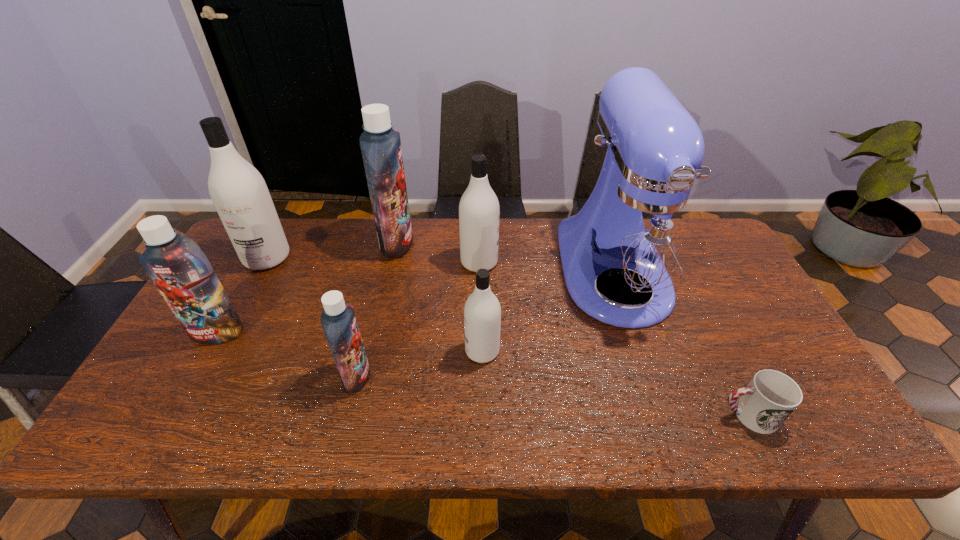
The image size is (960, 540). In order to click on the tallest object in this screenshot , I will do `click(640, 233)`.

The height and width of the screenshot is (540, 960). I want to click on mixer, so click(640, 233).

You are a GUI agent. You are given a task and a screenshot of the screen. Output one action in this format:
    pyautogui.click(x=<x>, y=<y>)
    Task: Click on the farthest blue shampoo
    
    Given the screenshot: What is the action you would take?
    pyautogui.click(x=380, y=145)

At what (x,y) coordinates should I click in order to perform the action: click on the biggest white shampoo. Please return your answer as a coordinate pair (x, y). Looking at the image, I should click on (239, 193).

Identify the location of the second biggest white shampoo. (479, 211).

Identify the location of the second biggest blue shampoo. The width and height of the screenshot is (960, 540). (176, 265).

The width and height of the screenshot is (960, 540). What are the coordinates of `the second nearest blue shampoo` in the screenshot? It's located at (176, 265).

Where is `the nearest blue shampoo`? This screenshot has height=540, width=960. the nearest blue shampoo is located at coordinates (338, 319).

Locate an element on the screen. This screenshot has width=960, height=540. the nearest white shampoo is located at coordinates (482, 313).

In order to click on red cup in this screenshot , I will do `click(771, 396)`.